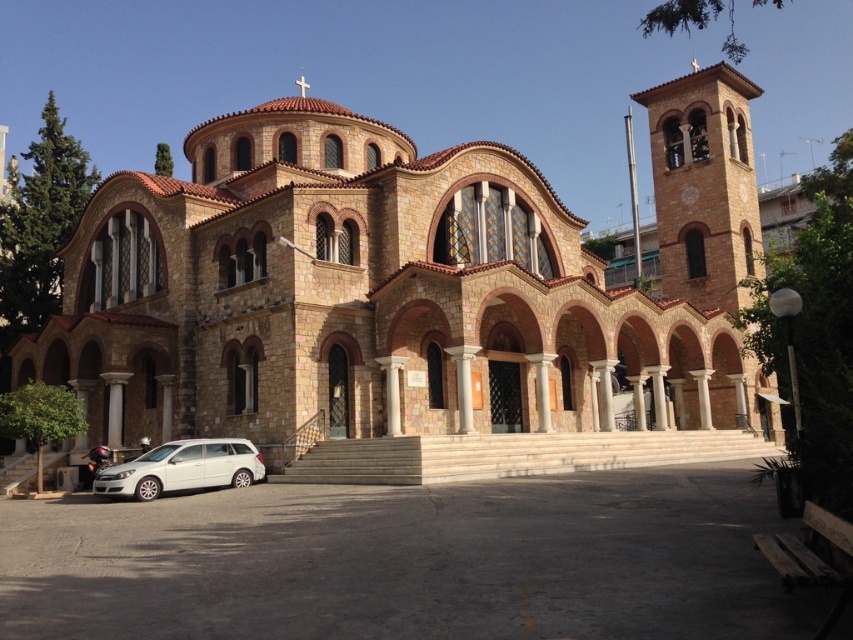
You are a photographer planning to take a picture of the brown stone church at center and the white matte station wagon at lower left. The church is blocking the view of the station wagon. Can you adjust your position so that both are visible in the frame without moving either object?

The brown stone church at center is positioned over the white matte station wagon at lower left, so moving the camera position to a lower angle or shifting sideways might allow both to be visible without obstruction.

You are standing at point 0.5, 0.5 in the image. You want to walk directly towards the brown stone church at center. In which direction should you move?

The brown stone church at center is located at point (x=403, y=285). Since you are at (x=426, y=320), you should move slightly to the left and down to reach it.